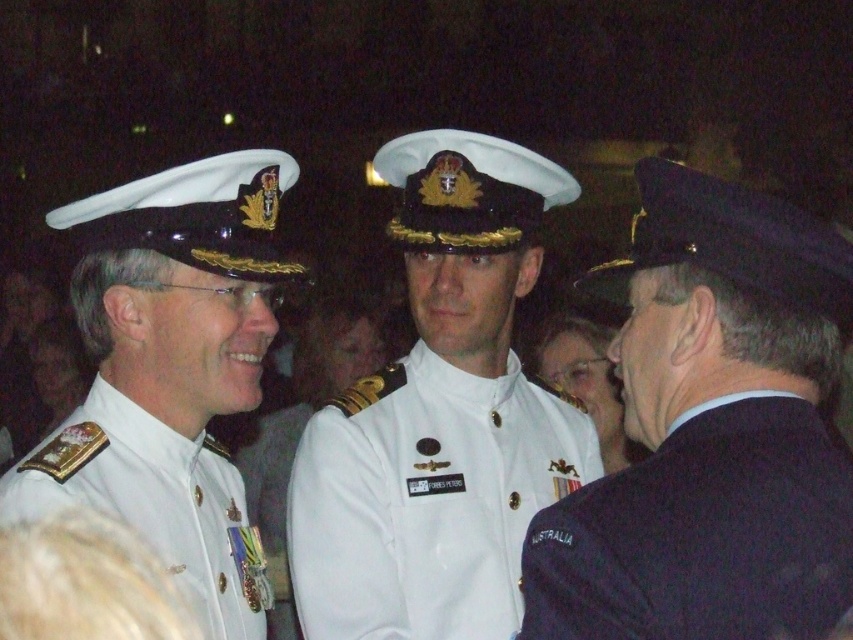
Question: Which point is farther from the camera taking this photo?

Choices:
 (A) (425, 497)
 (B) (228, 621)
 (C) (689, 481)
 (D) (44, 509)

Answer: (A)

Question: Can you confirm if white matte uniform at center is smaller than white matte uniform at left?

Choices:
 (A) yes
 (B) no

Answer: (B)

Question: Does white matte uniform at center appear on the left side of dark blue wool blazer at right?

Choices:
 (A) no
 (B) yes

Answer: (B)

Question: Among these objects, which one is farthest from the camera?

Choices:
 (A) white matte uniform at left
 (B) white glossy uniform at center
 (C) dark blue wool blazer at right
 (D) white matte uniform at center

Answer: (D)

Question: Which of these objects is positioned closest to the dark blue wool blazer at right?

Choices:
 (A) white matte uniform at center
 (B) white glossy uniform at center
 (C) white matte uniform at left

Answer: (C)

Question: Is white matte uniform at center thinner than dark blue wool blazer at right?

Choices:
 (A) yes
 (B) no

Answer: (B)